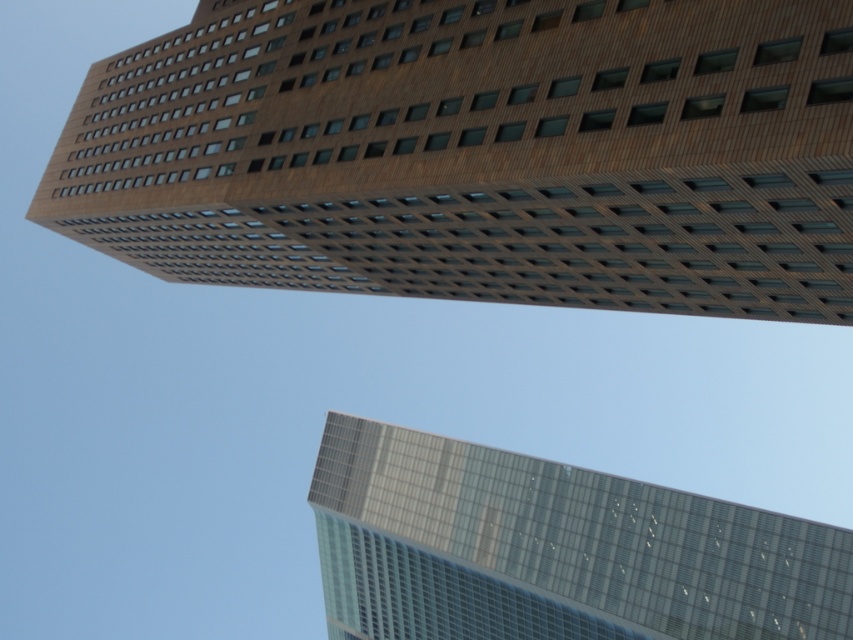
You are an architect analyzing the spatial relationship between the brown brick building at upper center and the transparent glass skyscraper at lower right. Which building is located higher in the image?

The brown brick building at upper center is positioned over the transparent glass skyscraper at lower right, meaning it is higher in the image.

From the picture: You are an architect analyzing the spatial relationship between the brown brick building at upper center and the transparent glass skyscraper at lower right. Which building is positioned to the right of the other?

The transparent glass skyscraper at lower right is to the right of the brown brick building at upper center.

You are an architect analyzing the spatial relationship between the brown brick building at upper center and the transparent glass skyscraper at lower right. Which building is closer to the observer?

The brown brick building at upper center is closer to the observer since it is positioned in front of the transparent glass skyscraper at lower right.